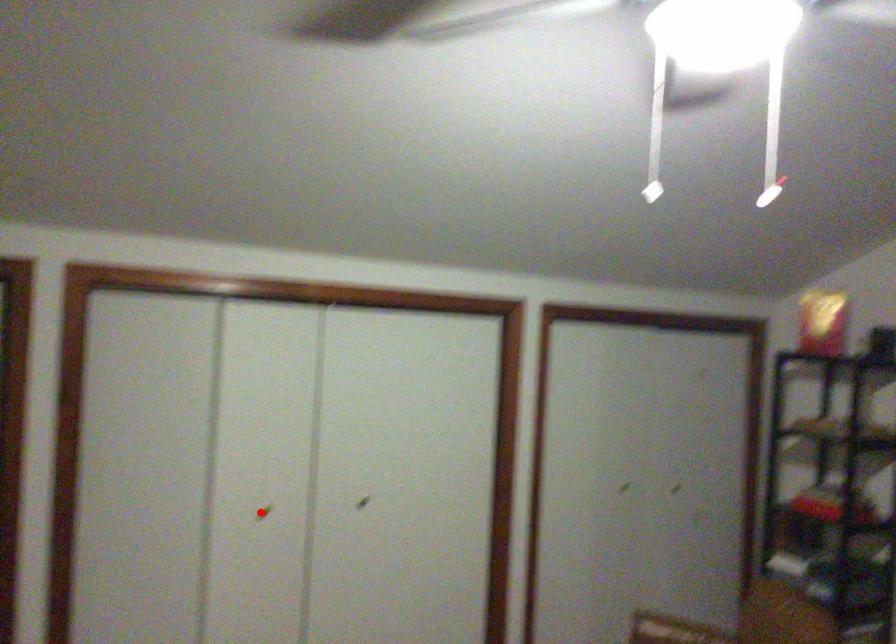
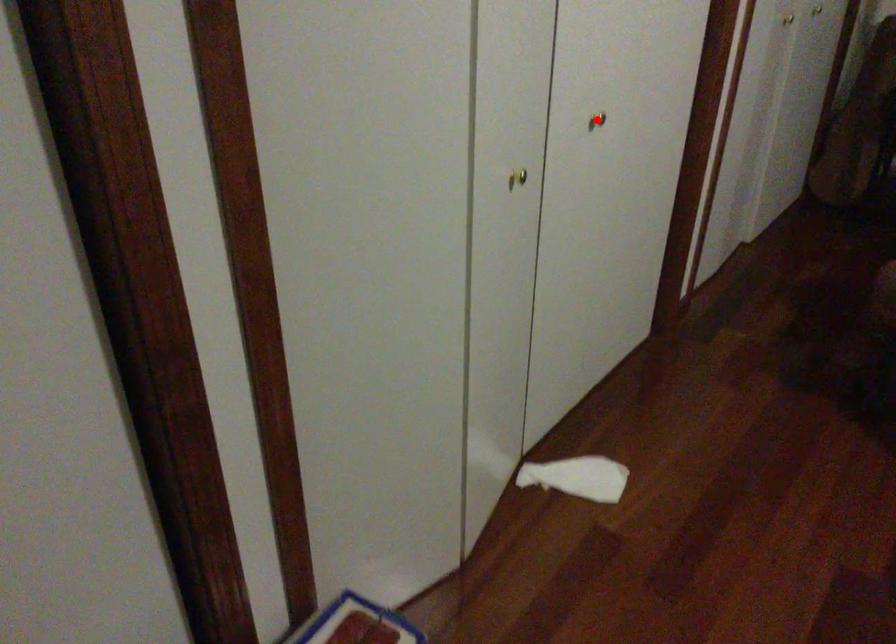
I am providing you with two images of the same scene from different viewpoints. A red point is marked on the first image and another point is marked on the second image. Is the marked point in image1 the same physical position as the marked point in image2?

No